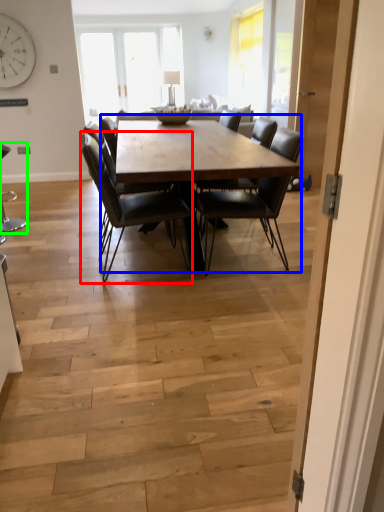
Question: Which is farther away from chair (highlighted by a red box)? coffee table (highlighted by a blue box) or chair (highlighted by a green box)?

Choices:
 (A) coffee table
 (B) chair

Answer: (B)